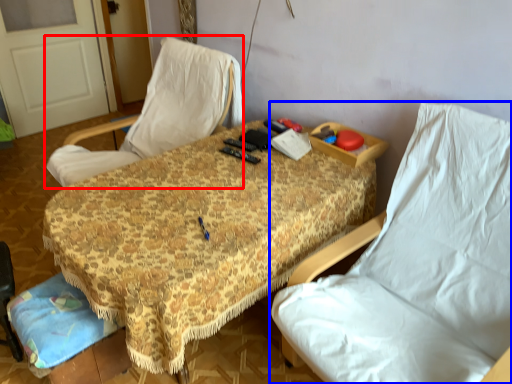
Question: Which point is closer to the camera, chair (highlighted by a red box) or chair (highlighted by a blue box)?

Choices:
 (A) chair
 (B) chair

Answer: (B)